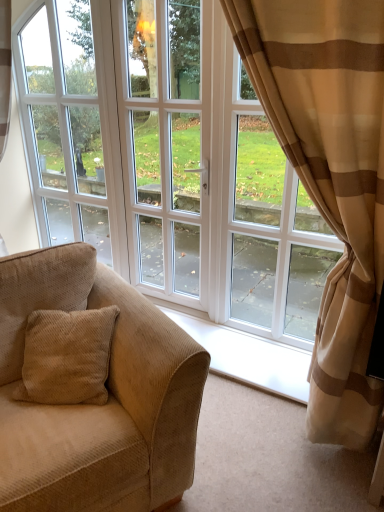
Where is `vacant space in beige striped curtain at right (from a real-world perspective)`? vacant space in beige striped curtain at right (from a real-world perspective) is located at coordinates (256, 409).